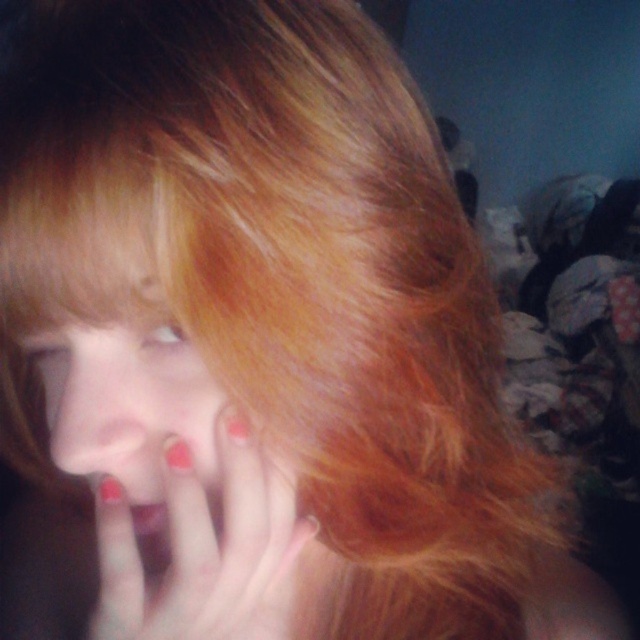
Is point (161, 588) closer to viewer compared to point (147, 413)?

That is False.

Is glossy nail polish at center closer to camera compared to matte red nails at center?

No, glossy nail polish at center is further to the viewer.

In order to click on glossy nail polish at center in this screenshot , I will do `click(198, 545)`.